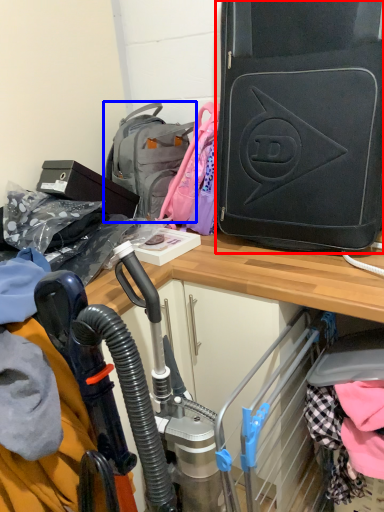
Question: Which of the following is the closest to the observer, luggage and bags (highlighted by a red box) or backpack (highlighted by a blue box)?

Choices:
 (A) luggage and bags
 (B) backpack

Answer: (A)